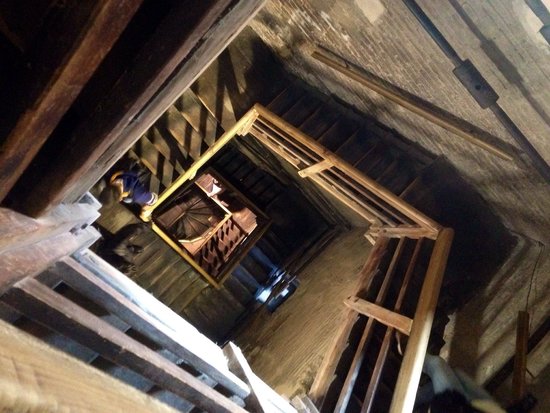
You are a GUI agent. You are given a task and a screenshot of the screen. Output one action in this format:
    pyautogui.click(x=<x>, y=<y>)
    Task: Click on the walls
    
    Given the screenshot: What is the action you would take?
    406,48, 346,92, 270,17, 533,191, 492,329